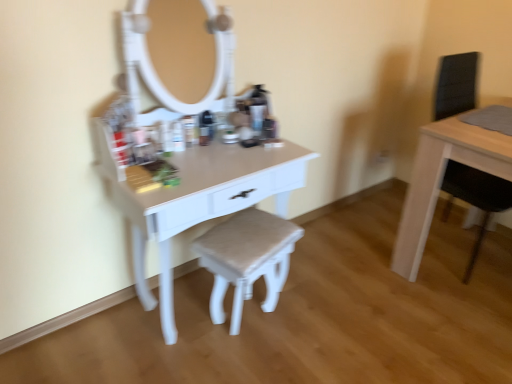
Where is `empty space that is ontop of matte white stool at center (from a real-world perspective)`? empty space that is ontop of matte white stool at center (from a real-world perspective) is located at coordinates (250, 234).